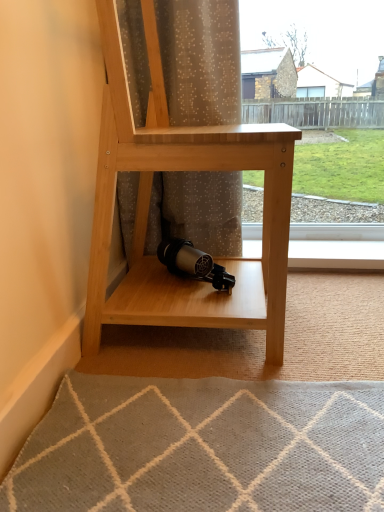
Question: Based on their positions, is natural wood shelf at center located to the left or right of translucent fabric curtain at center?

Choices:
 (A) left
 (B) right

Answer: (B)

Question: In the image, is natural wood shelf at center positioned in front of or behind translucent fabric curtain at center?

Choices:
 (A) behind
 (B) front

Answer: (B)

Question: Is natural wood shelf at center taller or shorter than translucent fabric curtain at center?

Choices:
 (A) short
 (B) tall

Answer: (B)

Question: Is translucent fabric curtain at center taller or shorter than natural wood shelf at center?

Choices:
 (A) short
 (B) tall

Answer: (A)

Question: In the image, is translucent fabric curtain at center on the left side or the right side of natural wood shelf at center?

Choices:
 (A) right
 (B) left

Answer: (B)

Question: Relative to natural wood shelf at center, is translucent fabric curtain at center in front or behind?

Choices:
 (A) front
 (B) behind

Answer: (B)

Question: From a real-world perspective, relative to natural wood shelf at center, is translucent fabric curtain at center vertically above or below?

Choices:
 (A) below
 (B) above

Answer: (B)